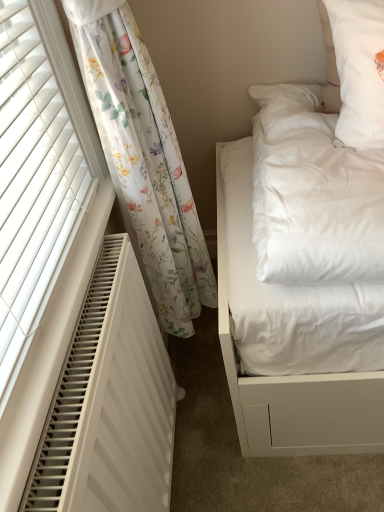
I want to click on vacant area on top of white textured radiator at left (from a real-world perspective), so click(95, 311).